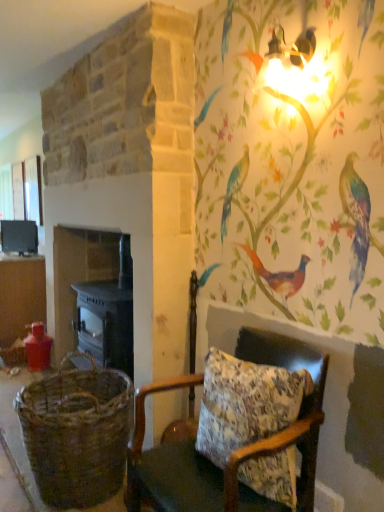
Question: Is floral fabric cushion at lower right not near matte black stove at left?

Choices:
 (A) no
 (B) yes

Answer: (B)

Question: Considering the relative positions of floral fabric cushion at lower right and matte black stove at left in the image provided, is floral fabric cushion at lower right in front of matte black stove at left?

Choices:
 (A) no
 (B) yes

Answer: (B)

Question: Considering the relative sizes of floral fabric cushion at lower right and matte black stove at left in the image provided, is floral fabric cushion at lower right taller than matte black stove at left?

Choices:
 (A) yes
 (B) no

Answer: (A)

Question: From a real-world perspective, is floral fabric cushion at lower right below matte black stove at left?

Choices:
 (A) yes
 (B) no

Answer: (A)

Question: From the image's perspective, does floral fabric cushion at lower right appear lower than matte black stove at left?

Choices:
 (A) yes
 (B) no

Answer: (A)

Question: Is floral fabric cushion at lower right not within matte black stove at left?

Choices:
 (A) yes
 (B) no

Answer: (A)

Question: Is woven brown basket at lower left wider than dark gray stone fireplace at left?

Choices:
 (A) no
 (B) yes

Answer: (B)

Question: Does woven brown basket at lower left have a smaller size compared to dark gray stone fireplace at left?

Choices:
 (A) no
 (B) yes

Answer: (B)

Question: Is woven brown basket at lower left thinner than dark gray stone fireplace at left?

Choices:
 (A) yes
 (B) no

Answer: (B)

Question: From a real-world perspective, is woven brown basket at lower left on dark gray stone fireplace at left?

Choices:
 (A) yes
 (B) no

Answer: (B)

Question: Is woven brown basket at lower left positioned beyond the bounds of dark gray stone fireplace at left?

Choices:
 (A) yes
 (B) no

Answer: (A)

Question: Is woven brown basket at lower left oriented towards dark gray stone fireplace at left?

Choices:
 (A) yes
 (B) no

Answer: (B)

Question: Can you confirm if matte black stove at left is smaller than matte brown table at left?

Choices:
 (A) no
 (B) yes

Answer: (B)